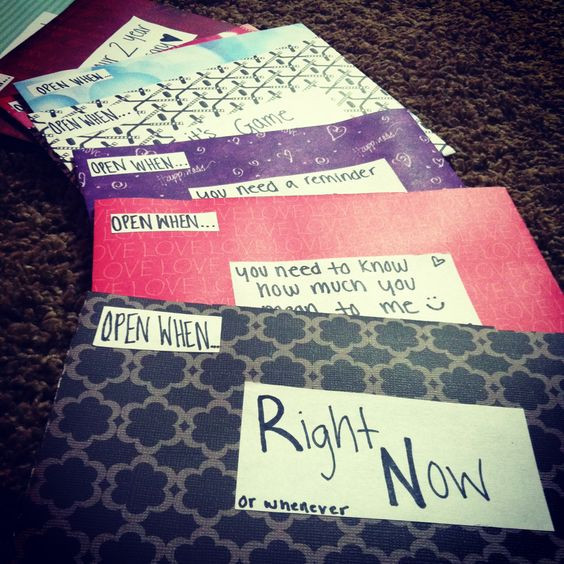
Image resolution: width=564 pixels, height=564 pixels. I want to click on carpet, so coord(480,59).